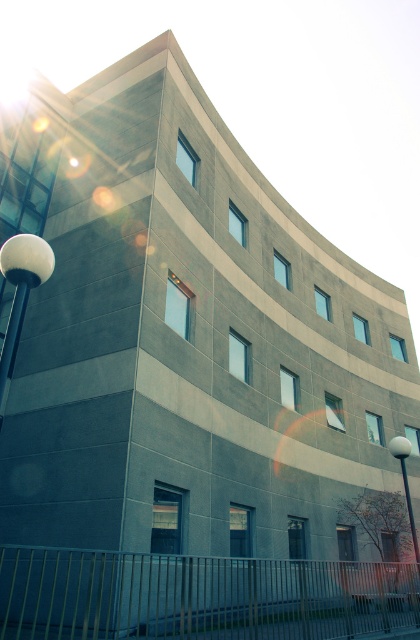
Question: Can you confirm if white glossy sphere at upper left is bigger than white glossy lamp post at lower right?

Choices:
 (A) yes
 (B) no

Answer: (A)

Question: Which point is farther to the camera?

Choices:
 (A) (412, 528)
 (B) (21, 280)

Answer: (A)

Question: Can you confirm if white glossy sphere at upper left is thinner than white glossy lamp post at lower right?

Choices:
 (A) no
 (B) yes

Answer: (A)

Question: Which point appears closest to the camera in this image?

Choices:
 (A) (23, 273)
 (B) (407, 451)

Answer: (A)

Question: Considering the relative positions of white glossy sphere at upper left and white glossy lamp post at lower right in the image provided, where is white glossy sphere at upper left located with respect to white glossy lamp post at lower right?

Choices:
 (A) below
 (B) above

Answer: (B)